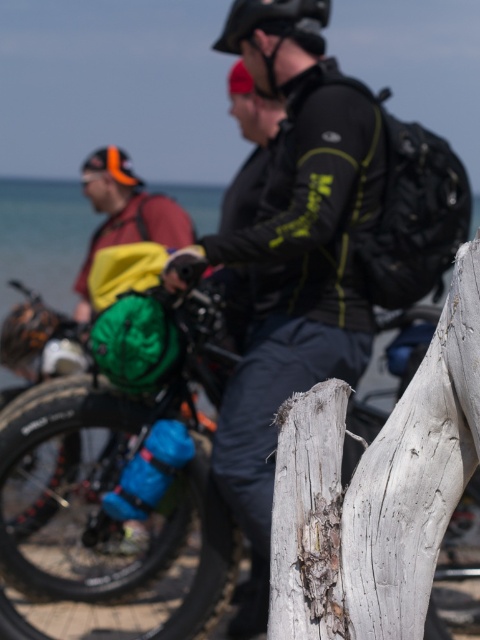
You are standing at the beach and see the matte black bicycle at center and the matte black jacket at center. Which object is taller when viewed from the front?

The matte black jacket at center is taller than the matte black bicycle at center when viewed from the front.

You are standing at the edge of the beach scene and see the matte black bicycle at center and the matte black jacket at center. Which object is positioned more to the left?

The matte black bicycle at center is positioned more to the left than the matte black jacket at center.